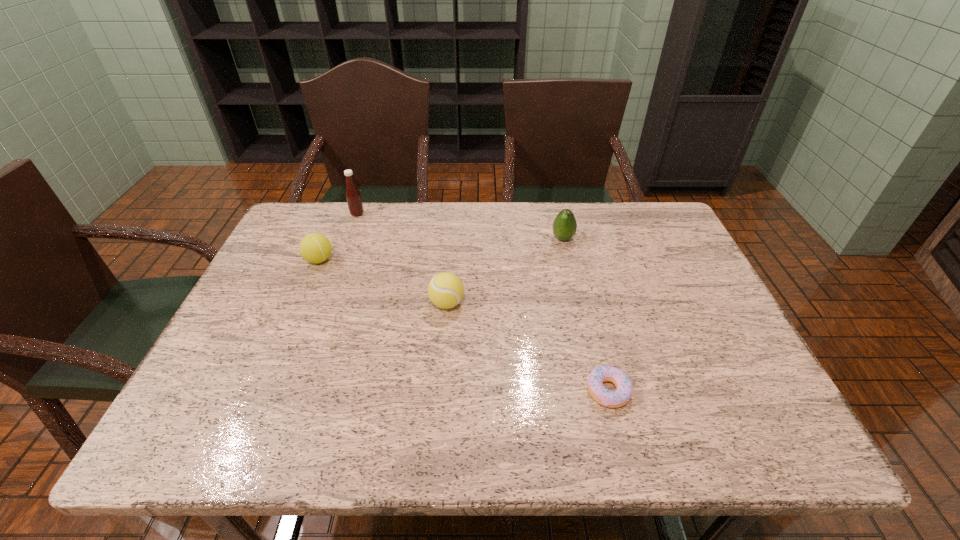
Where is `vacant point at the left edge`? This screenshot has height=540, width=960. vacant point at the left edge is located at coordinates (272, 255).

Find the location of a particular element. The height and width of the screenshot is (540, 960). vacant point at the right edge is located at coordinates (640, 267).

Locate an element on the screen. This screenshot has width=960, height=540. free space at the far left corner is located at coordinates (314, 230).

At what (x,y) coordinates should I click in order to perform the action: click on free region at the far right corner of the desktop. Please return your answer as a coordinate pair (x, y). Looking at the image, I should click on (646, 209).

In order to click on vacant space at the near right corner of the desktop in this screenshot , I will do tap(765, 451).

Where is `empty location between the avocado and the second nearest object`? The width and height of the screenshot is (960, 540). empty location between the avocado and the second nearest object is located at coordinates (505, 271).

The height and width of the screenshot is (540, 960). What are the coordinates of `blank region between the Tabasco sauce and the nearest object` in the screenshot? It's located at (483, 302).

The image size is (960, 540). I want to click on vacant area that lies between the left tennis ball and the second farthest object, so click(441, 249).

Locate an element on the screen. free space between the Tabasco sauce and the doughnut is located at coordinates 483,302.

Find the location of `vacant point located between the third object from right to left and the tallest object`. vacant point located between the third object from right to left and the tallest object is located at coordinates (402, 259).